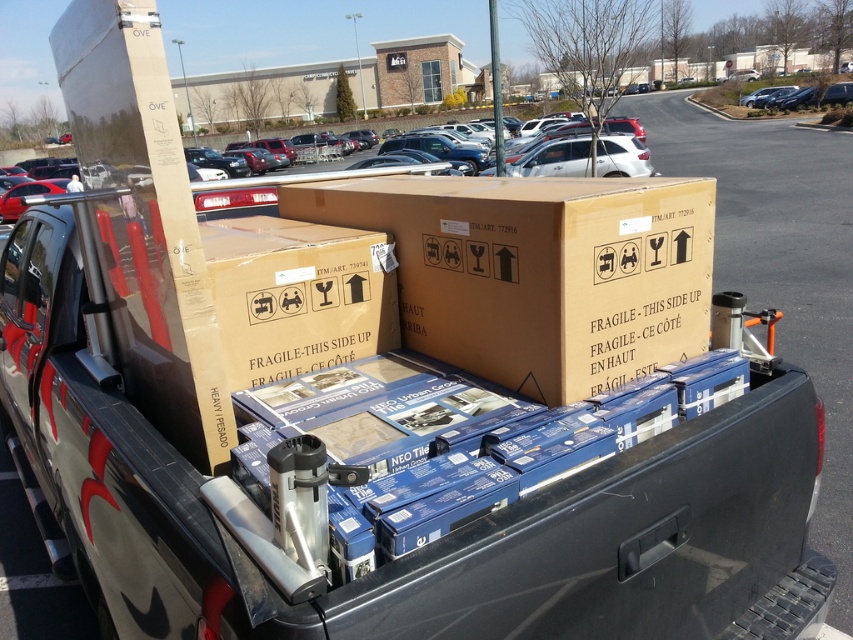
Can you confirm if brown cardboard box at center is shorter than white matte suv at center?

Correct, brown cardboard box at center is not as tall as white matte suv at center.

Can you confirm if brown cardboard box at center is smaller than white matte suv at center?

Correct, brown cardboard box at center occupies less space than white matte suv at center.

Find the location of `brown cardboard box at center`. brown cardboard box at center is located at coordinates [x=538, y=272].

At what (x,y) coordinates should I click in order to perform the action: click on brown cardboard box at center. Please return your answer as a coordinate pair (x, y). The width and height of the screenshot is (853, 640). Looking at the image, I should click on (538, 272).